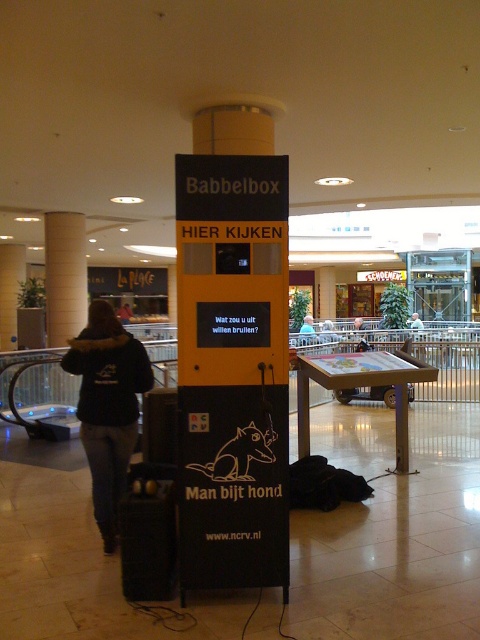
You are at a shopping mall and see two jackets displayed in the window. The black fleece jacket at left and the blue denim jacket at center. Which jacket is positioned closer to the left side of the window?

The black fleece jacket at left is positioned closer to the left side of the window as it is to the left of the blue denim jacket at center.

Based on the photo, you are a customer in a mall looking to purchase a jacket. You see the black fleece jacket at left and the blue denim jacket at center. Which jacket is taller?

The black fleece jacket at left is much taller than the blue denim jacket at center.

You are standing in a shopping mall and see the yellow matte babbelbox at center and the white glossy pillar at upper left. Which object is positioned lower in the image?

The yellow matte babbelbox at center is located below the white glossy pillar at upper left, so it is positioned lower in the image.